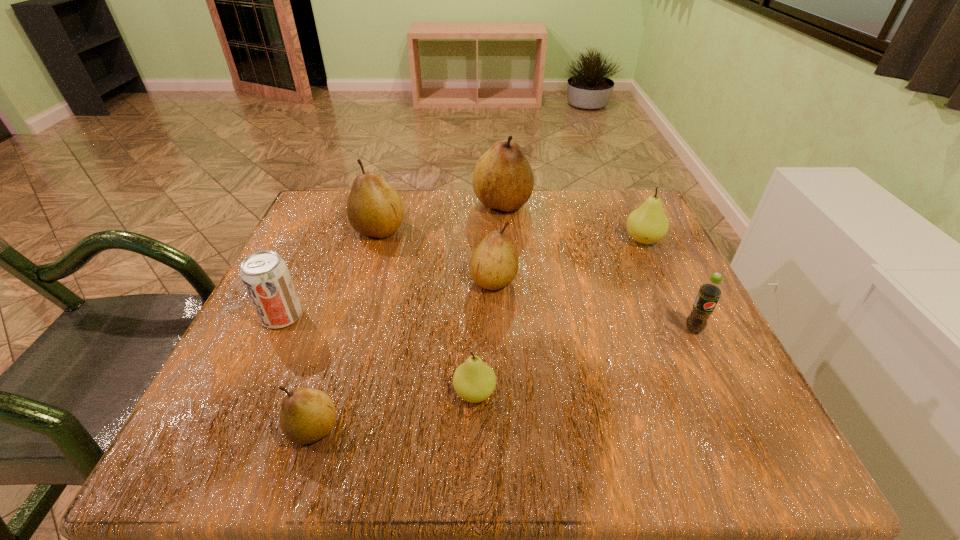
You are a GUI agent. You are given a task and a screenshot of the screen. Output one action in this format:
    pyautogui.click(x=<x>, y=<y>)
    Task: Click on the vacant region located on the left of the smaller green pear
    The height and width of the screenshot is (540, 960).
    Given the screenshot: What is the action you would take?
    pyautogui.click(x=409, y=393)

At what (x,y) coordinates should I click in order to perform the action: click on soda can present at the left edge. Please return your answer as a coordinate pair (x, y). Looking at the image, I should click on (265, 275).

This screenshot has width=960, height=540. What are the coordinates of `pear that is at the right edge` in the screenshot? It's located at (648, 224).

Identify the location of soda that is at the right edge. (709, 293).

The height and width of the screenshot is (540, 960). What are the coordinates of `object present at the far left corner` in the screenshot? It's located at (374, 209).

Where is `object situated at the near left corner`? Image resolution: width=960 pixels, height=540 pixels. object situated at the near left corner is located at coordinates (306, 415).

Find the location of a particular element. The image size is (960, 540). object present at the far right corner is located at coordinates (648, 224).

I want to click on vacant area at the far edge, so click(423, 191).

The width and height of the screenshot is (960, 540). Find the location of `vacant space at the near edge of the desktop`. vacant space at the near edge of the desktop is located at coordinates (305, 466).

In the image, there is a desktop. Where is `free space at the left edge`? The width and height of the screenshot is (960, 540). free space at the left edge is located at coordinates (306, 328).